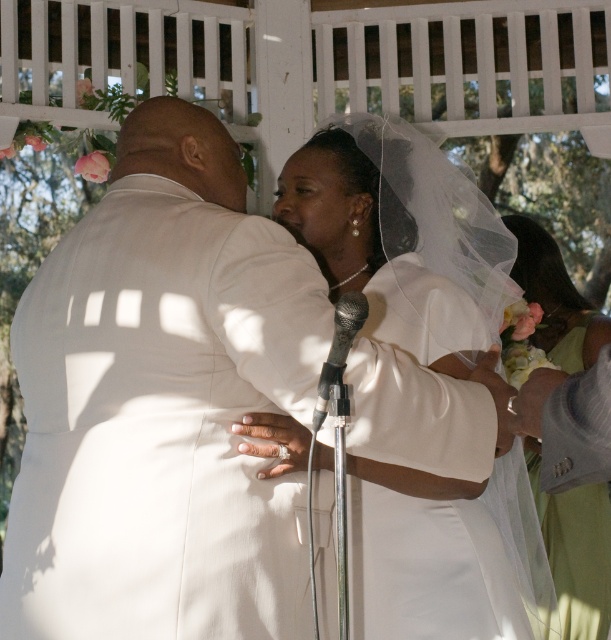
Question: Observing the image, what is the correct spatial positioning of white satin dress at center in reference to black metallic microphone at center?

Choices:
 (A) below
 (B) above

Answer: (B)

Question: Observing the image, what is the correct spatial positioning of white satin veil at right in reference to black metallic microphone at center?

Choices:
 (A) below
 (B) above

Answer: (B)

Question: Among these objects, which one is farthest from the camera?

Choices:
 (A) white satin dress at center
 (B) white satin veil at right
 (C) black metallic microphone at center

Answer: (B)

Question: Can you confirm if white satin veil at right is positioned below black metallic microphone at center?

Choices:
 (A) no
 (B) yes

Answer: (A)

Question: Which object is closer to the camera taking this photo?

Choices:
 (A) white satin veil at right
 (B) black metallic microphone at center

Answer: (B)

Question: Among these objects, which one is nearest to the camera?

Choices:
 (A) white satin dress at center
 (B) black metallic microphone at center
 (C) white satin veil at right

Answer: (B)